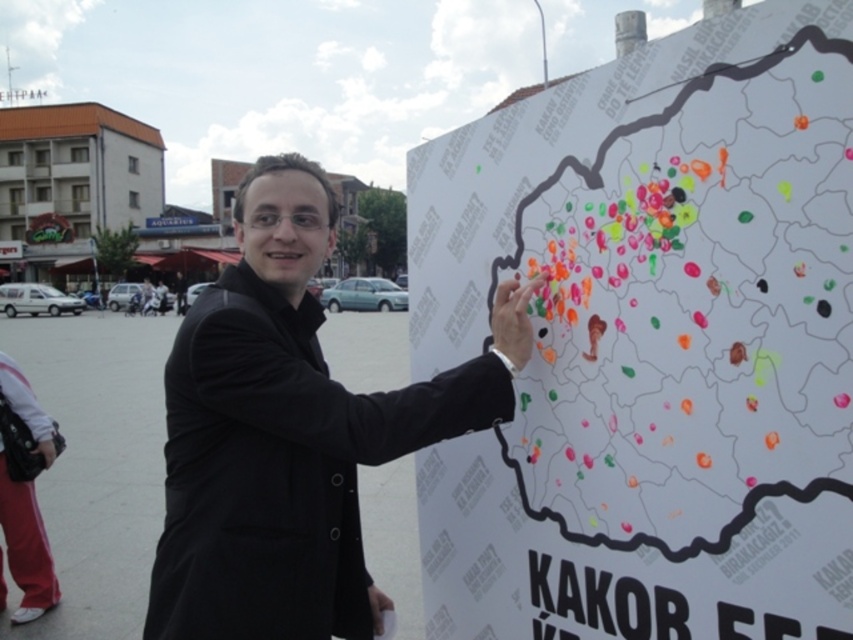
You are a tourist in the plaza and want to take a photo of the map. You notice two points on the map at coordinates point (671, 454) and point (195, 564). Which point should you focus on to ensure it appears larger in your photo?

Point (671, 454) is closer to the viewer than point (195, 564), so focusing on point (671, 454) will make it appear larger in the photo.

You are a tourist in the plaza and want to check the map. Since you are holding a large backpack, you need to know which object is taller between the white paper map at center and the black matte coat at center to ensure you can see the map without bending down. Which one is taller?

The white paper map at center has a greater height compared to the black matte coat at center, so you can see the map without bending down as it is taller.

You are standing in the plaza and want to touch the point at coordinates (634, 474) on the map. If your arm can reach up to 1.2 meters, can you reach it?

The distance of point (634, 474) from viewer is 1.51 meters, so no, you cannot reach it with an arm that can only extend 1.2 meters.